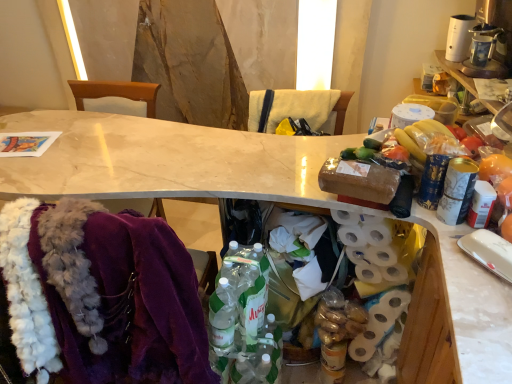
Describe the element at coordinates (115, 92) in the screenshot. The width and height of the screenshot is (512, 384). I see `purple fabric chair at left, positioned as the 2th chair in right-to-left order` at that location.

Image resolution: width=512 pixels, height=384 pixels. What are the coordinates of `white matte toilet paper at right` in the screenshot? It's located at (383, 290).

At what (x,y) coordinates should I click in order to perform the action: click on velvet fur scarf at lower left. Please return your answer as a coordinate pair (x, y). The image size is (512, 384). Looking at the image, I should click on (101, 295).

Image resolution: width=512 pixels, height=384 pixels. What do you see at coordinates (239, 222) in the screenshot?
I see `brown fabric chair at center, which is the second chair from left to right` at bounding box center [239, 222].

The width and height of the screenshot is (512, 384). Identify the location of purple fabric chair at left, the first chair viewed from the left. (115, 92).

How many degrees apart are the facing directions of brown fabric chair at center, the 1th chair positioned from the right, and purple fabric chair at left, the first chair viewed from the left?

There is a 0.000101-degree angle between the facing directions of brown fabric chair at center, the 1th chair positioned from the right, and purple fabric chair at left, the first chair viewed from the left.

Between brown fabric chair at center, which is the second chair from left to right, and purple fabric chair at left, positioned as the 2th chair in right-to-left order, which one is positioned behind?

purple fabric chair at left, positioned as the 2th chair in right-to-left order, is further from the camera.

Consider the image. Is brown fabric chair at center, which is the second chair from left to right, turned away from purple fabric chair at left, positioned as the 2th chair in right-to-left order?

brown fabric chair at center, which is the second chair from left to right, is not turned away from purple fabric chair at left, positioned as the 2th chair in right-to-left order.

Does brown fabric chair at center, the 1th chair positioned from the right, have a greater width compared to purple fabric chair at left, the first chair viewed from the left?

Correct, the width of brown fabric chair at center, the 1th chair positioned from the right, exceeds that of purple fabric chair at left, the first chair viewed from the left.

Does point (196, 188) come closer to viewer compared to point (222, 362)?

That is True.

Who is bigger, white marble desk at center or translucent plastic bottles at center?

With larger size is white marble desk at center.

Consider the image. Does white marble desk at center lie in front of translucent plastic bottles at center?

Yes, it is in front of translucent plastic bottles at center.

Consider the image. Does white marble desk at center have a lesser width compared to translucent plastic bottles at center?

No, white marble desk at center is not thinner than translucent plastic bottles at center.

From a real-world perspective, between velvet fur scarf at lower left and white marble desk at center, who is vertically higher?

From a 3D spatial view, velvet fur scarf at lower left is above.

Considering the positions of point (115, 262) and point (54, 154), is point (115, 262) closer or farther from the camera than point (54, 154)?

Point (115, 262) is positioned closer to the camera compared to point (54, 154).

Would you say white marble desk at center is part of velvet fur scarf at lower left's contents?

No, velvet fur scarf at lower left does not contain white marble desk at center.

Consider the image. Is velvet fur scarf at lower left not near white marble desk at center?

They are positioned close to each other.

Which is farther, (206, 338) or (214, 325)?

The point (214, 325) is farther.

Who is shorter, velvet fur scarf at lower left or translucent plastic bottles at center?

translucent plastic bottles at center is shorter.

Which object is positioned more to the right, velvet fur scarf at lower left or translucent plastic bottles at center?

translucent plastic bottles at center is more to the right.

How much distance is there between velvet fur scarf at lower left and translucent plastic bottles at center?

The distance of velvet fur scarf at lower left from translucent plastic bottles at center is 12.55 inches.

Looking at this image, choose the correct answer: Is brown fabric chair at center, the 1th chair positioned from the right, inside white matte toilet paper at right or outside it?

brown fabric chair at center, the 1th chair positioned from the right, is spatially situated outside white matte toilet paper at right.

From a real-world perspective, is brown fabric chair at center, which is the second chair from left to right, positioned under white matte toilet paper at right based on gravity?

Actually, brown fabric chair at center, which is the second chair from left to right, is physically above white matte toilet paper at right in the real world.

Is brown fabric chair at center, which is the second chair from left to right, bigger than white matte toilet paper at right?

Yes, brown fabric chair at center, which is the second chair from left to right, is bigger than white matte toilet paper at right.

Between point (230, 207) and point (412, 251), which one is positioned behind?

The point (230, 207) is more distant.

In the scene shown: Who is smaller, brown fabric chair at center, the 1th chair positioned from the right, or velvet fur scarf at lower left?

velvet fur scarf at lower left.

From a real-world perspective, is brown fabric chair at center, which is the second chair from left to right, positioned over velvet fur scarf at lower left based on gravity?

Actually, brown fabric chair at center, which is the second chair from left to right, is physically below velvet fur scarf at lower left in the real world.

Is brown fabric chair at center, which is the second chair from left to right, thinner than velvet fur scarf at lower left?

In fact, brown fabric chair at center, which is the second chair from left to right, might be wider than velvet fur scarf at lower left.

Is brown fabric chair at center, the 1th chair positioned from the right, located outside velvet fur scarf at lower left?

Yes, brown fabric chair at center, the 1th chair positioned from the right, is not within velvet fur scarf at lower left.

Is translucent plastic bottles at center next to white marble desk at center?

No, translucent plastic bottles at center is not in contact with white marble desk at center.

Considering the sizes of objects translucent plastic bottles at center and white marble desk at center in the image provided, who is thinner, translucent plastic bottles at center or white marble desk at center?

translucent plastic bottles at center is thinner.

Is translucent plastic bottles at center oriented towards white marble desk at center?

Yes, translucent plastic bottles at center faces towards white marble desk at center.

From the image's perspective, which one is positioned lower, translucent plastic bottles at center or white marble desk at center?

translucent plastic bottles at center appears lower in the image.

In the image, there is a purple fabric chair at left, the first chair viewed from the left. What are the coordinates of `chair below it (from a real-world perspective)` in the screenshot? It's located at (239, 222).

The image size is (512, 384). Find the location of `desk on the left of translucent plastic bottles at center`. desk on the left of translucent plastic bottles at center is located at coordinates (167, 161).

Estimate the real-world distances between objects in this image. Which object is further from translucent plastic bottles at center, yellow fabric at upper center or white marble desk at center?

yellow fabric at upper center.

Looking at the image, which one is located closer to purple fabric chair at left, the first chair viewed from the left, white marble desk at center or translucent plastic bottles at center?

white marble desk at center.

From the image, which object appears to be farther from velvet fur scarf at lower left, translucent plastic bottles at center or white matte toilet paper at right?

white matte toilet paper at right.

Considering their positions, is white matte toilet paper at right positioned further to white marble desk at center than yellow fabric at upper center?

yellow fabric at upper center lies further to white marble desk at center than the other object.

Looking at this image, which object lies nearer to the anchor point brown fabric chair at center, the 1th chair positioned from the right, yellow fabric at upper center or purple fabric chair at left, positioned as the 2th chair in right-to-left order?

yellow fabric at upper center is positioned closer to the anchor brown fabric chair at center, the 1th chair positioned from the right.

Looking at the image, which one is located closer to velvet fur scarf at lower left, white matte toilet paper at right or yellow fabric at upper center?

Based on the image, white matte toilet paper at right appears to be nearer to velvet fur scarf at lower left.

Estimate the real-world distances between objects in this image. Which object is closer to translucent plastic bottles at center, purple fabric chair at left, positioned as the 2th chair in right-to-left order, or white matte toilet paper at right?

The object closer to translucent plastic bottles at center is white matte toilet paper at right.

Looking at the image, which one is located closer to velvet fur scarf at lower left, translucent plastic bottles at center or purple fabric chair at left, positioned as the 2th chair in right-to-left order?

The object closer to velvet fur scarf at lower left is translucent plastic bottles at center.

At what (x,y) coordinates should I click in order to perform the action: click on bottle between purple fabric chair at left, the first chair viewed from the left, and white matte toilet paper at right from left to right. Please return your answer as a coordinate pair (x, y). This screenshot has width=512, height=384. Looking at the image, I should click on (x=244, y=320).

Locate an element on the screen. This screenshot has height=384, width=512. desk between purple fabric chair at left, positioned as the 2th chair in right-to-left order, and brown fabric chair at center, the 1th chair positioned from the right, from left to right is located at coordinates (167, 161).

Locate an element on the screen. Image resolution: width=512 pixels, height=384 pixels. toilet paper between brown fabric chair at center, which is the second chair from left to right, and translucent plastic bottles at center in the up-down direction is located at coordinates (383, 290).

Where is `bottle positioned between velvet fur scarf at lower left and purple fabric chair at left, positioned as the 2th chair in right-to-left order, from near to far`? This screenshot has width=512, height=384. bottle positioned between velvet fur scarf at lower left and purple fabric chair at left, positioned as the 2th chair in right-to-left order, from near to far is located at coordinates coord(244,320).